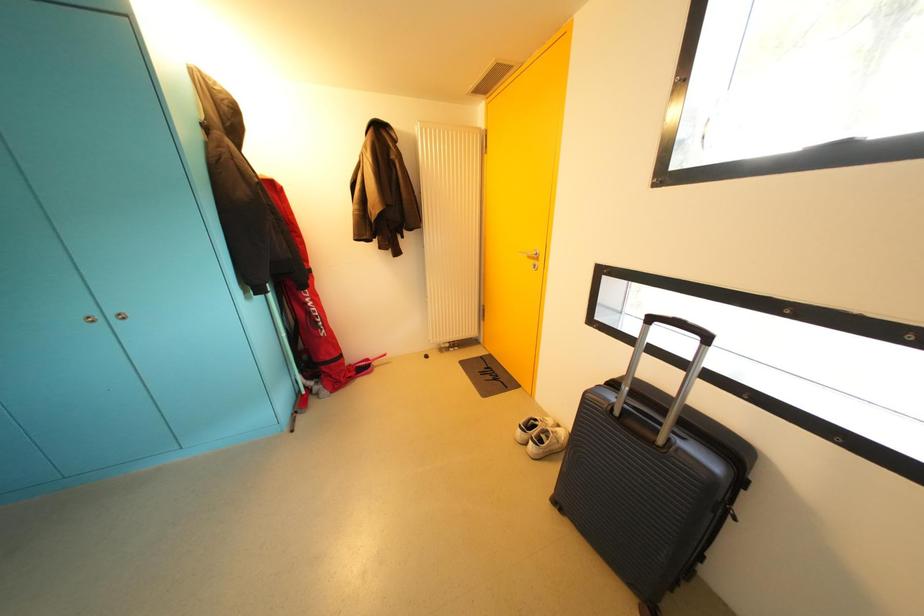
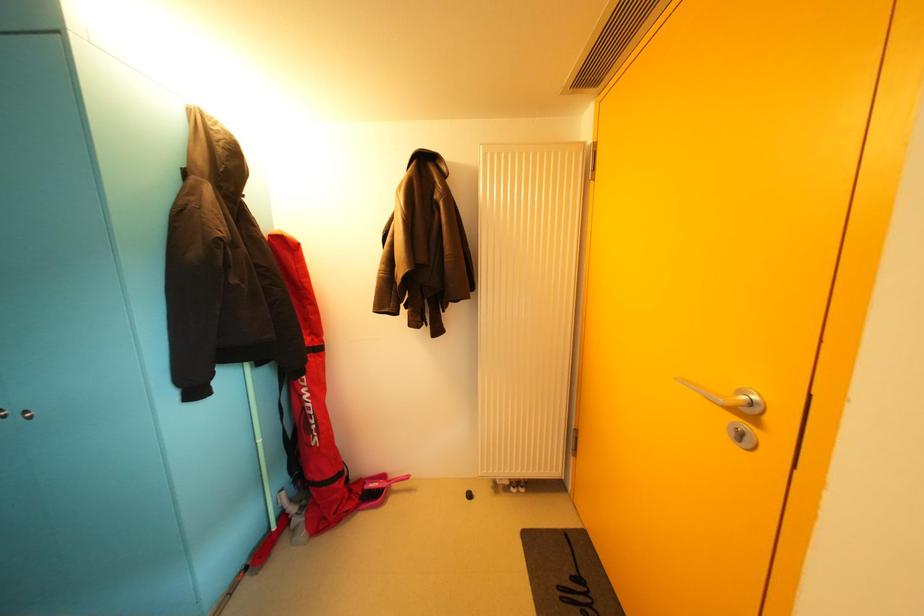
Question: The camera is either moving clockwise (left) or counter-clockwise (right) around the object. The first image is from the beginning of the video and the second image is from the end. Is the camera moving left or right when shooting the video?

Choices:
 (A) Left
 (B) Right

Answer: (B)